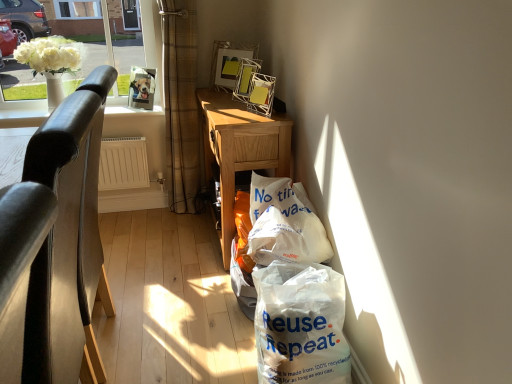
Find the location of `brown plaid curtain at upper left`. brown plaid curtain at upper left is located at coordinates (181, 105).

This screenshot has height=384, width=512. What do you see at coordinates (61, 238) in the screenshot?
I see `black leather chair at left` at bounding box center [61, 238].

Identify the location of black leather chair at left. The width and height of the screenshot is (512, 384). (61, 238).

The width and height of the screenshot is (512, 384). What are the coordinates of `white glass vase at upper left` in the screenshot? It's located at (22, 87).

Describe the element at coordinates (228, 63) in the screenshot. The height and width of the screenshot is (384, 512). I see `metallic wire picture frame at upper center` at that location.

Identify the location of brown plaid curtain at upper left. click(181, 105).

Considering the positions of objects metallic wire picture frame at upper center and white plastic bag at center in the image provided, who is behind, metallic wire picture frame at upper center or white plastic bag at center?

metallic wire picture frame at upper center is further away from the camera.

Can you confirm if metallic wire picture frame at upper center is smaller than white plastic bag at center?

Yes, metallic wire picture frame at upper center is smaller than white plastic bag at center.

From the image's perspective, would you say metallic wire picture frame at upper center is shown under white plastic bag at center?

Actually, metallic wire picture frame at upper center appears above white plastic bag at center in the image.

Is metallic wire picture frame at upper center positioned beyond the bounds of white plastic bag at center?

Indeed, metallic wire picture frame at upper center is completely outside white plastic bag at center.

Considering the positions of objects white plastic bag at lower right and black leather chair at left in the image provided, who is more to the left, white plastic bag at lower right or black leather chair at left?

black leather chair at left.

Locate an element on the screen. chair on the left of white plastic bag at lower right is located at coordinates (61, 238).

Between white plastic bag at lower right and black leather chair at left, which one is positioned behind?

white plastic bag at lower right is further from the camera.

Looking at this image, can you tell me how much white plastic bag at lower right and wooden desk at center differ in facing direction?

white plastic bag at lower right and wooden desk at center are facing 0.155 degrees away from each other.

Does white plastic bag at lower right appear on the right side of wooden desk at center?

Yes.

Between white plastic bag at lower right and wooden desk at center, which one has larger size?

Result: wooden desk at center.

Considering the relative sizes of white plastic bag at lower right and wooden desk at center in the image provided, is white plastic bag at lower right thinner than wooden desk at center?

Yes, white plastic bag at lower right is thinner than wooden desk at center.

Is white glass vase at upper left positioned behind brown plaid curtain at upper left?

Yes, it is.

Is white glass vase at upper left in contact with brown plaid curtain at upper left?

No, white glass vase at upper left is not making contact with brown plaid curtain at upper left.

Locate an element on the screen. curtain below the white glass vase at upper left (from the image's perspective) is located at coordinates (181, 105).

Between white glass vase at upper left and brown plaid curtain at upper left, which one has larger size?

brown plaid curtain at upper left is bigger.

From a real-world perspective, is white plastic bag at center under metallic wire picture frame at upper center?

Yes, from a real-world perspective, white plastic bag at center is beneath metallic wire picture frame at upper center.

Considering the positions of objects white plastic bag at center and metallic wire picture frame at upper center in the image provided, who is more to the left, white plastic bag at center or metallic wire picture frame at upper center?

metallic wire picture frame at upper center is more to the left.

Can you tell me how much white plastic bag at center and metallic wire picture frame at upper center differ in facing direction?

There is a 44.4-degree angle between the facing directions of white plastic bag at center and metallic wire picture frame at upper center.

Is white glass vase at upper left not within black leather chair at left?

white glass vase at upper left is positioned outside black leather chair at left.

In the scene shown: Is white glass vase at upper left in contact with black leather chair at left?

No, white glass vase at upper left is not touching black leather chair at left.

Can you tell me how much white glass vase at upper left and black leather chair at left differ in facing direction?

91.5 degrees.

Is white glass vase at upper left facing towards black leather chair at left?

Yes.

How many degrees apart are the facing directions of black leather chair at left and white plastic bag at center?

The angular difference between black leather chair at left and white plastic bag at center is 0.735 degrees.

Which is further, (94, 71) or (256, 197)?

The point (256, 197) is behind.

Does black leather chair at left turn towards white plastic bag at center?

No, black leather chair at left is not turned towards white plastic bag at center.

Does black leather chair at left lie in front of white plastic bag at center?

Yes, black leather chair at left is closer to the camera.

At what (x,y) coordinates should I click in order to perform the action: click on picture frame above the white plastic bag at center (from the image's perspective). Please return your answer as a coordinate pair (x, y). The height and width of the screenshot is (384, 512). Looking at the image, I should click on (228, 63).

The height and width of the screenshot is (384, 512). What are the coordinates of `chair above the white plastic bag at lower right (from a real-world perspective)` in the screenshot? It's located at (61, 238).

Which object lies nearer to the anchor point metallic wire picture frame at upper center, brown plaid curtain at upper left or white plastic bag at center?

Among the two, brown plaid curtain at upper left is located nearer to metallic wire picture frame at upper center.

From the image, which object appears to be nearer to white plastic bag at center, black leather chair at left or metallic wire picture frame at upper center?

black leather chair at left lies closer to white plastic bag at center than the other object.

When comparing their distances from black leather chair at left, does white plastic bag at center or brown plaid curtain at upper left seem further?

Among the two, brown plaid curtain at upper left is located further to black leather chair at left.

Which object lies nearer to the anchor point brown plaid curtain at upper left, wooden desk at center or white plastic bag at lower right?

Based on the image, wooden desk at center appears to be nearer to brown plaid curtain at upper left.

Considering their positions, is brown plaid curtain at upper left positioned closer to wooden desk at center than black leather chair at left?

brown plaid curtain at upper left.

From the image, which object appears to be farther from white glass vase at upper left, wooden desk at center or white plastic bag at center?

Among the two, white plastic bag at center is located further to white glass vase at upper left.

Based on their spatial positions, is white glass vase at upper left or white plastic bag at center closer to brown plaid curtain at upper left?

white glass vase at upper left lies closer to brown plaid curtain at upper left than the other object.

Which object lies nearer to the anchor point metallic wire picture frame at upper center, brown plaid curtain at upper left or white plastic bag at lower right?

Among the two, brown plaid curtain at upper left is located nearer to metallic wire picture frame at upper center.

Image resolution: width=512 pixels, height=384 pixels. I want to click on curtain located between white glass vase at upper left and metallic wire picture frame at upper center in the left-right direction, so click(x=181, y=105).

The image size is (512, 384). I want to click on curtain between black leather chair at left and white glass vase at upper left along the z-axis, so click(x=181, y=105).

Where is `plastic bag between black leather chair at left and white glass vase at upper left along the z-axis`? The width and height of the screenshot is (512, 384). plastic bag between black leather chair at left and white glass vase at upper left along the z-axis is located at coordinates (300, 324).

In order to click on desk between white glass vase at upper left and white plastic bag at center in this screenshot , I will do `click(240, 149)`.